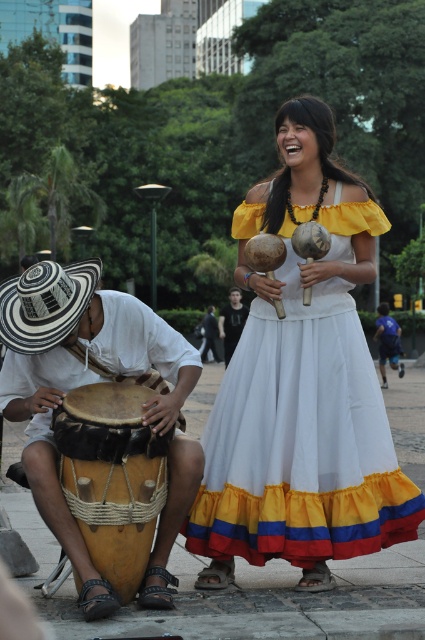
Can you confirm if leather drum at lower left is taller than brown leather drum at lower left?

Indeed, leather drum at lower left has a greater height compared to brown leather drum at lower left.

Find the location of a particular element. The height and width of the screenshot is (640, 425). leather drum at lower left is located at coordinates (81, 380).

Identify the location of white cotton dress at center. (302, 385).

Which is more to the left, white cotton dress at center or dark brown leather drum at center?

dark brown leather drum at center is more to the left.

Between point (340, 504) and point (240, 328), which one is positioned behind?

Positioned behind is point (240, 328).

You are a GUI agent. You are given a task and a screenshot of the screen. Output one action in this format:
    pyautogui.click(x=<x>, y=<y>)
    Task: Click on the white cotton dress at center
    This screenshot has height=640, width=425.
    Given the screenshot: What is the action you would take?
    pyautogui.click(x=302, y=385)

Is white cotton dress at center to the right of leather drum at lower left from the viewer's perspective?

Correct, you'll find white cotton dress at center to the right of leather drum at lower left.

Find the location of a particular element. The width and height of the screenshot is (425, 640). white cotton dress at center is located at coordinates (302, 385).

Does point (368, 547) come farther from viewer compared to point (178, 346)?

No, it is in front of (178, 346).

Locate an element on the screen. The image size is (425, 640). white cotton dress at center is located at coordinates (302, 385).